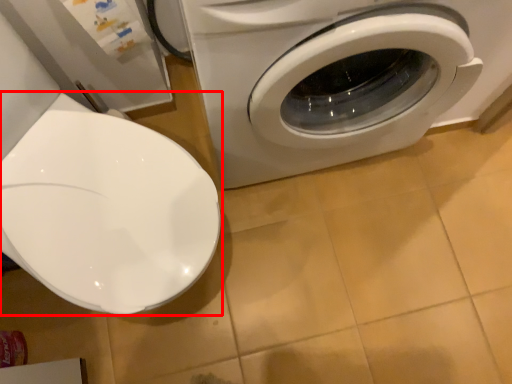
Question: In this image, where is toilet (annotated by the red box) located relative to washing machine?

Choices:
 (A) right
 (B) left

Answer: (B)